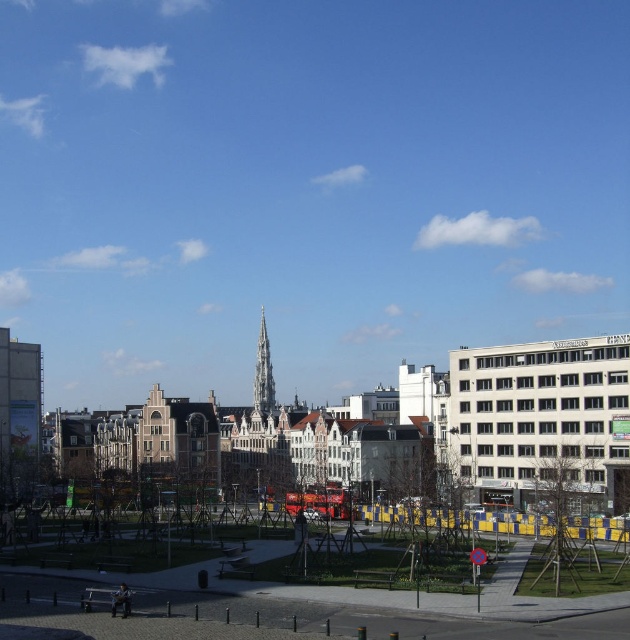
You are standing in the plaza and want to reach the point marked at coordinates (x=193, y=579). If your walking speed is 3 feet per second, how many seconds will it take you to reach that point?

The distance between you and the point marked at coordinates (x=193, y=579) is 246.39 feet. At a walking speed of 3 feet per second, it would take approximately 82.13 seconds to reach the point.

You are a drone operator trying to capture a photo of the blue glass spire at center and green grass at center from above. Based on their positions, which one would appear to the left in your camera view?

The blue glass spire at center is to the left of the green grass at center, so in the camera view, the blue glass spire at center would appear to the left of the green grass at center.

You are a city planner reviewing the urban layout. You need to determine if the green grass at center can be mowed without affecting the blue glass spire at center. Based on their heights, is this possible?

The green grass at center is not as tall as the blue glass spire at center, so mowing the green grass at center would not interfere with the blue glass spire at center since it is shorter.